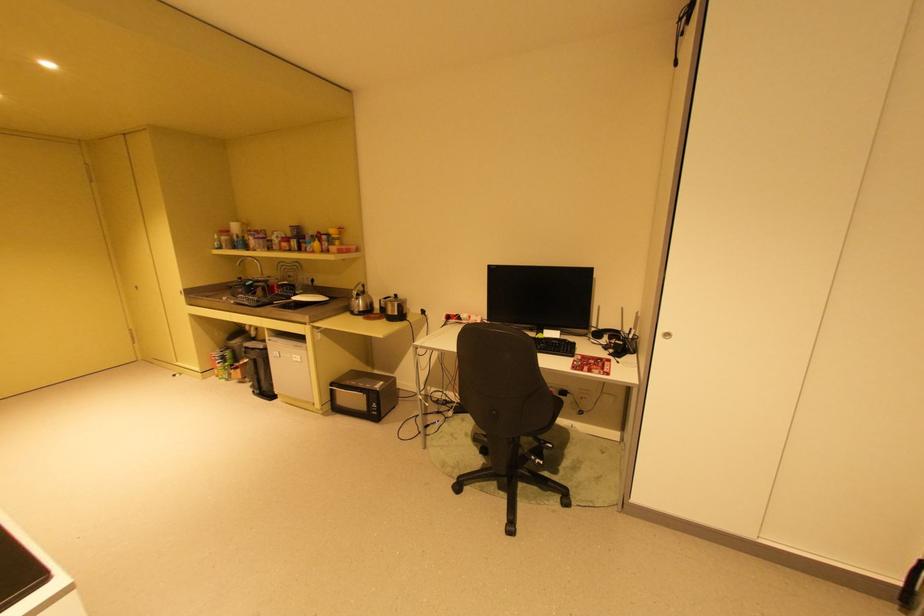
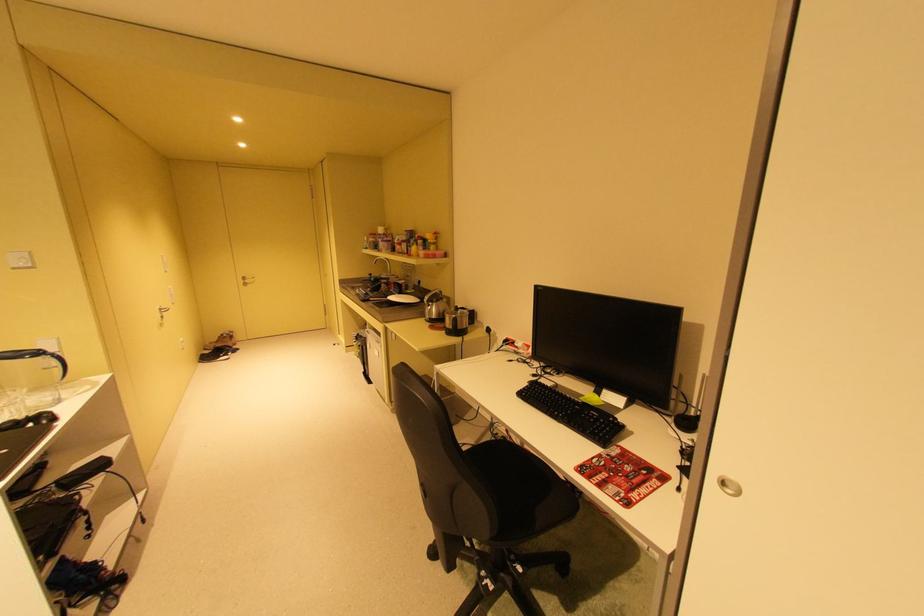
Locate, in the second image, the point that corresponds to point 566,345 in the first image.

(604, 419)